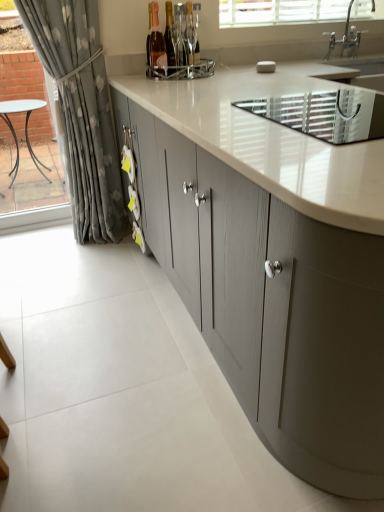
Question: From the image's perspective, is white textured blinds at upper center located above or below pink glass bottle at upper center, placed as the 1th bottle when sorted from left to right?

Choices:
 (A) above
 (B) below

Answer: (A)

Question: Considering the positions of white textured blinds at upper center and pink glass bottle at upper center, placed as the 1th bottle when sorted from left to right, in the image, is white textured blinds at upper center bigger or smaller than pink glass bottle at upper center, placed as the 1th bottle when sorted from left to right,?

Choices:
 (A) small
 (B) big

Answer: (B)

Question: Estimate the real-world distances between objects in this image. Which object is farther from the matte glass bottle at center, positioned as the 2th bottle in left-to-right order?

Choices:
 (A) matte glass bottle at center, which is the 1th bottle in right-to-left order
 (B) matte gray cabinets at center
 (C) white textured sink at upper right
 (D) white textured blinds at upper center
 (E) pink glass bottle at upper center, placed as the 1th bottle when sorted from left to right

Answer: (B)

Question: Considering the real-world distances, which object is farthest from the matte gray cabinets at center?

Choices:
 (A) pink glass bottle at upper center, placed as the 1th bottle when sorted from left to right
 (B) silver metallic faucet at upper right
 (C) gray floral fabric curtain at left
 (D) matte glass bottle at center, which is the third bottle from left to right
 (E) matte glass bottle at center, positioned as the 2th bottle in left-to-right order

Answer: (B)